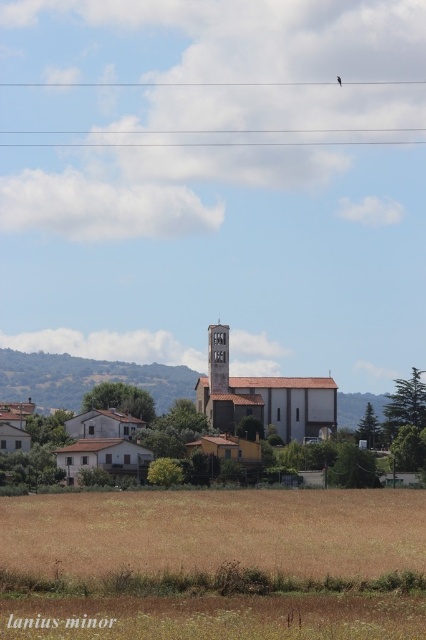
This screenshot has width=426, height=640. Describe the element at coordinates (216, 131) in the screenshot. I see `clear plastic wire at upper center` at that location.

Which is below, clear plastic wire at upper center or rustic stone bell tower at center?

Positioned lower is rustic stone bell tower at center.

The height and width of the screenshot is (640, 426). Identify the location of clear plastic wire at upper center. (216, 131).

Is point (173, 545) positioned in front of point (222, 83)?

Yes.

Is point (249, 538) farther from camera compared to point (230, 84)?

No, (249, 538) is in front of (230, 84).

The width and height of the screenshot is (426, 640). Identify the location of brown grassland at lower center. (215, 531).

Can you confirm if brown grassland at lower center is bigger than rustic stone bell tower at center?

Correct, brown grassland at lower center is larger in size than rustic stone bell tower at center.

Is point (218, 552) positioned behind point (213, 348)?

That is False.

Does point (206, 547) lie in front of point (210, 378)?

Yes, it is in front of point (210, 378).

This screenshot has width=426, height=640. What are the coordinates of `brown grassland at lower center` in the screenshot? It's located at (215, 531).